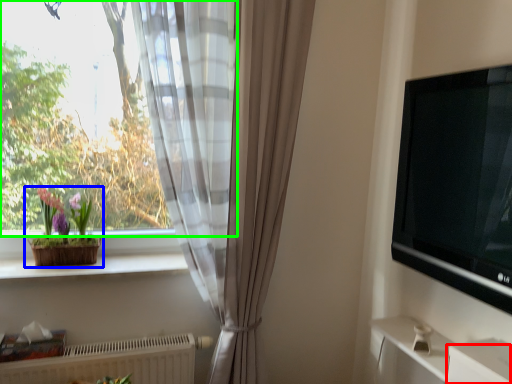
Question: Which is farther away from drawer (highlighted by a red box)? houseplant (highlighted by a blue box) or window (highlighted by a green box)?

Choices:
 (A) houseplant
 (B) window

Answer: (B)